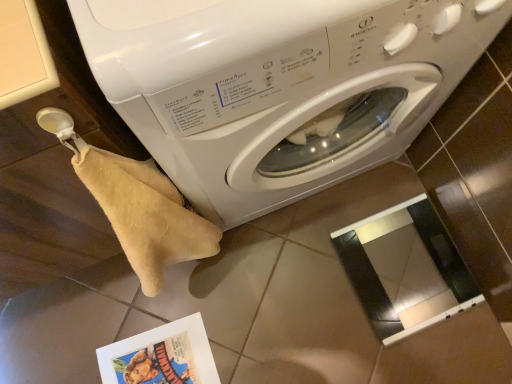
Question: From the image's perspective, is white glossy washing machine at center on top of matte paper comic book at lower left?

Choices:
 (A) yes
 (B) no

Answer: (A)

Question: Does white glossy washing machine at center have a greater height compared to matte paper comic book at lower left?

Choices:
 (A) yes
 (B) no

Answer: (A)

Question: Does white glossy washing machine at center have a lesser height compared to matte paper comic book at lower left?

Choices:
 (A) no
 (B) yes

Answer: (A)

Question: Is white glossy washing machine at center outside of matte paper comic book at lower left?

Choices:
 (A) yes
 (B) no

Answer: (A)

Question: Is white glossy washing machine at center in contact with matte paper comic book at lower left?

Choices:
 (A) yes
 (B) no

Answer: (B)

Question: From a real-world perspective, is white glossy washing machine at center physically above matte paper comic book at lower left?

Choices:
 (A) no
 (B) yes

Answer: (B)

Question: Is matte paper comic book at lower left oriented towards white glossy washing machine at center?

Choices:
 (A) yes
 (B) no

Answer: (B)

Question: From the image's perspective, is matte paper comic book at lower left below white glossy washing machine at center?

Choices:
 (A) yes
 (B) no

Answer: (A)

Question: Can you confirm if matte paper comic book at lower left is positioned to the right of white glossy washing machine at center?

Choices:
 (A) yes
 (B) no

Answer: (B)

Question: Is matte paper comic book at lower left next to white glossy washing machine at center and touching it?

Choices:
 (A) yes
 (B) no

Answer: (B)

Question: Considering the relative sizes of matte paper comic book at lower left and white glossy washing machine at center in the image provided, is matte paper comic book at lower left taller than white glossy washing machine at center?

Choices:
 (A) yes
 (B) no

Answer: (B)

Question: From a real-world perspective, is matte paper comic book at lower left beneath white glossy washing machine at center?

Choices:
 (A) no
 (B) yes

Answer: (B)

Question: Looking at the image, does matte paper comic book at lower left seem bigger or smaller compared to white glossy washing machine at center?

Choices:
 (A) small
 (B) big

Answer: (A)